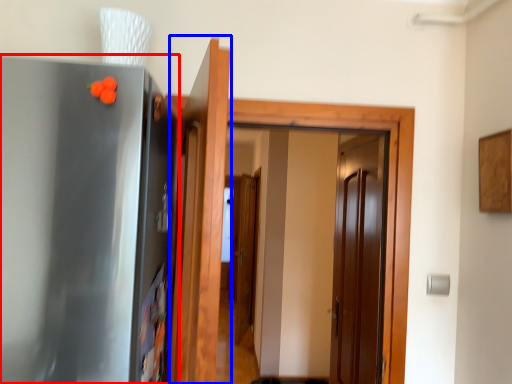
Question: Which object appears closest to the camera in this image, appliance (highlighted by a red box) or door (highlighted by a blue box)?

Choices:
 (A) appliance
 (B) door

Answer: (B)